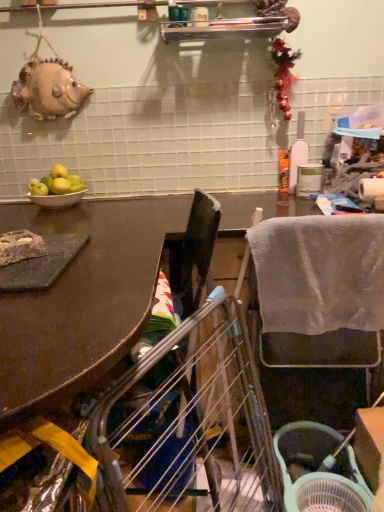
Question: Is metallic silver shelf at upper center thinner than matte gray stone at left?

Choices:
 (A) no
 (B) yes

Answer: (A)

Question: Is metallic silver shelf at upper center wider than matte gray stone at left?

Choices:
 (A) yes
 (B) no

Answer: (A)

Question: Does metallic silver shelf at upper center have a lesser height compared to matte gray stone at left?

Choices:
 (A) no
 (B) yes

Answer: (A)

Question: Is metallic silver shelf at upper center not within matte gray stone at left?

Choices:
 (A) no
 (B) yes

Answer: (B)

Question: Considering the relative sizes of metallic silver shelf at upper center and matte gray stone at left in the image provided, is metallic silver shelf at upper center bigger than matte gray stone at left?

Choices:
 (A) yes
 (B) no

Answer: (A)

Question: Is metallic silver shelf at upper center facing away from matte gray stone at left?

Choices:
 (A) yes
 (B) no

Answer: (B)

Question: Is metallic silver shelf at upper center completely or partially inside matte gray stone at left?

Choices:
 (A) yes
 (B) no

Answer: (B)

Question: From a real-world perspective, is matte gray stone at left located beneath metallic silver shelf at upper center?

Choices:
 (A) yes
 (B) no

Answer: (A)

Question: Is matte gray stone at left further to camera compared to metallic silver shelf at upper center?

Choices:
 (A) no
 (B) yes

Answer: (A)

Question: From a real-world perspective, does matte gray stone at left stand above metallic silver shelf at upper center?

Choices:
 (A) no
 (B) yes

Answer: (A)

Question: Can you confirm if matte gray stone at left is wider than metallic silver shelf at upper center?

Choices:
 (A) yes
 (B) no

Answer: (B)

Question: Is matte gray stone at left to the left of metallic silver shelf at upper center from the viewer's perspective?

Choices:
 (A) no
 (B) yes

Answer: (B)

Question: Is brown matte table at upper left completely or partially outside of white ceramic bowl at left?

Choices:
 (A) no
 (B) yes

Answer: (B)